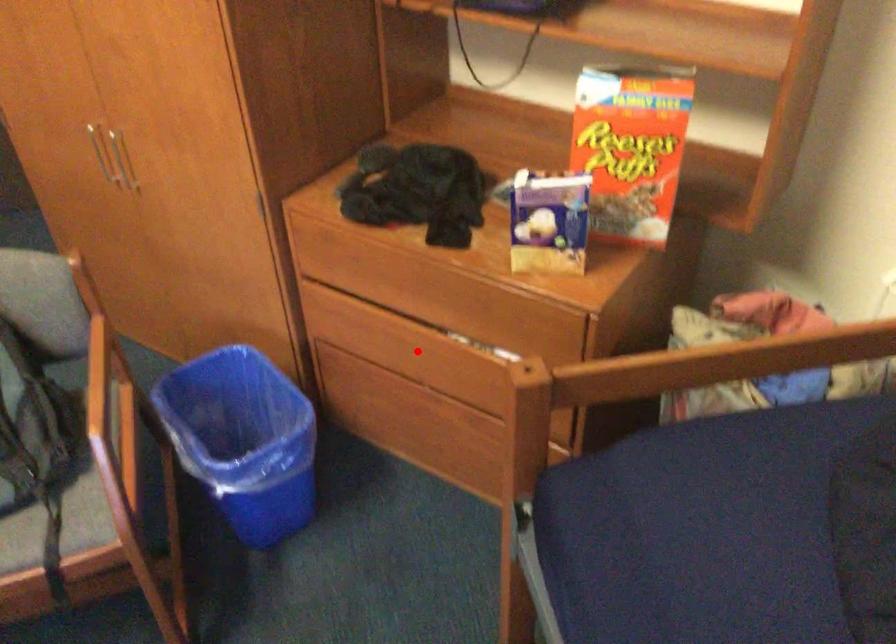
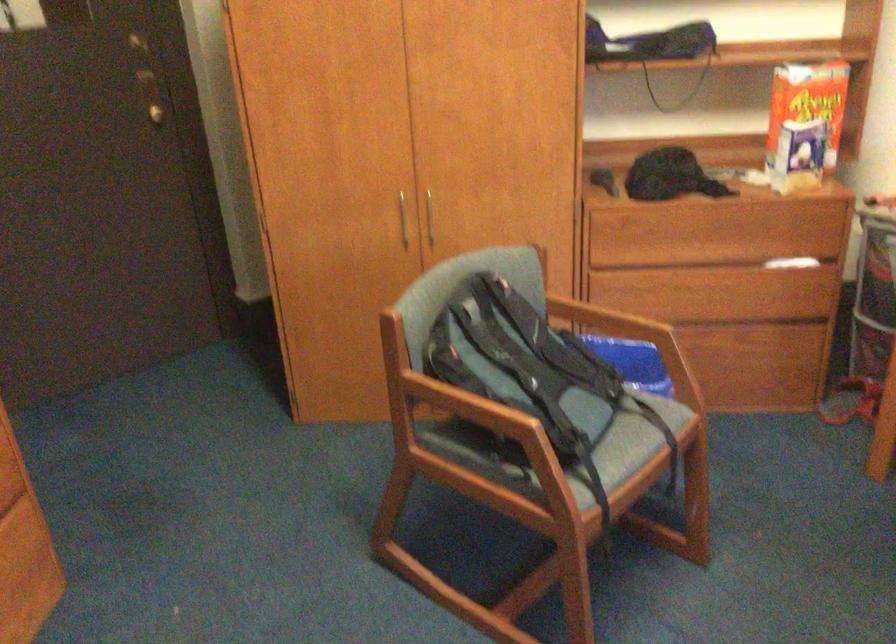
Question: I am providing you with two images of the same scene from different viewpoints. Given a red point in image1, look at the same physical point in image2. Is it:

Choices:
 (A) Closer to the viewpoint
 (B) Farther from the viewpoint

Answer: (B)